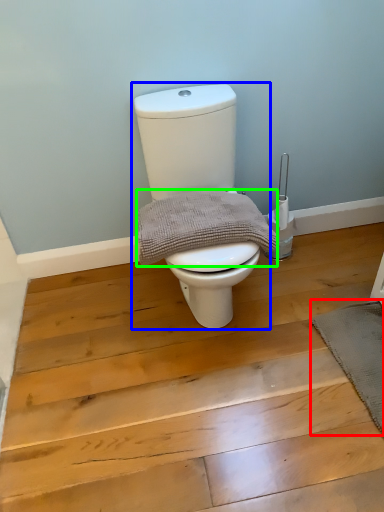
Question: Which object is positioned farthest from bath mat (highlighted by a red box)? Select from toilet (highlighted by a blue box) and material (highlighted by a green box).

Choices:
 (A) toilet
 (B) material

Answer: (A)